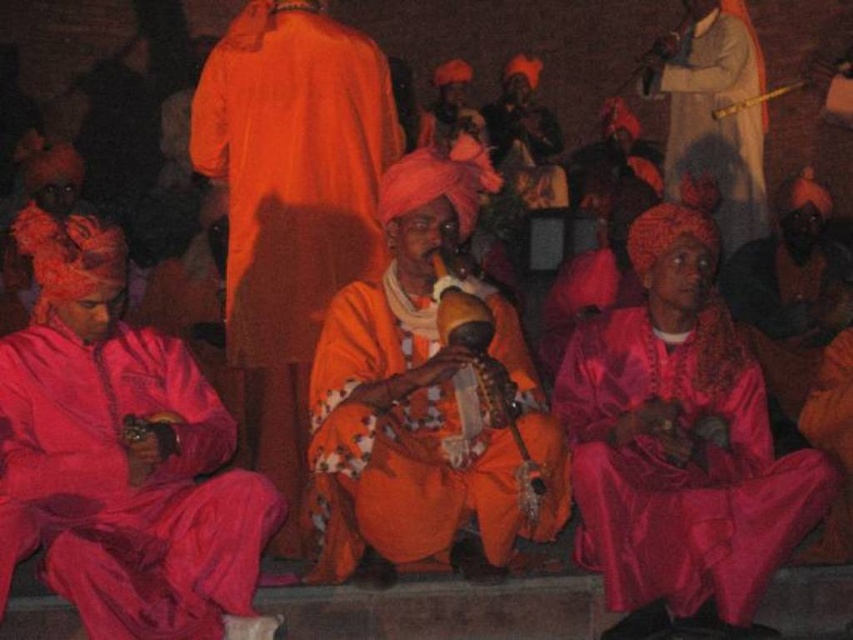
Question: Does orange silk robe at center appear on the right side of silky beige robe at upper right?

Choices:
 (A) yes
 (B) no

Answer: (B)

Question: Which of the following is the closest to the observer?

Choices:
 (A) matte pink robe at left
 (B) shiny silk robe at lower right
 (C) orange silk robe at center
 (D) orange satin robe at center

Answer: (A)

Question: Which point is farther from the camera taking this photo?

Choices:
 (A) (169, 593)
 (B) (749, 586)
 (C) (323, 76)
 (D) (500, 292)

Answer: (D)

Question: Which point is closer to the camera?

Choices:
 (A) 368,288
 (B) 160,440
 (C) 715,3

Answer: (B)

Question: Is matte pink robe at left positioned before orange silk robe at center?

Choices:
 (A) no
 (B) yes

Answer: (B)

Question: Can you confirm if matte pink robe at left is positioned below orange satin robe at center?

Choices:
 (A) no
 (B) yes

Answer: (A)